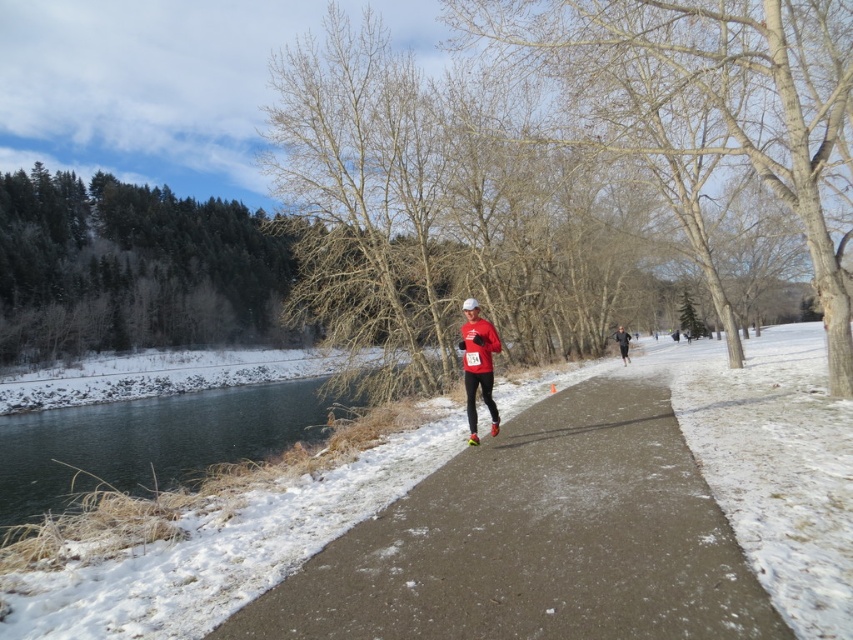
Where is `smooth asphalt path at center`? Image resolution: width=853 pixels, height=640 pixels. smooth asphalt path at center is located at coordinates click(x=537, y=540).

Which is below, smooth asphalt path at center or black running suit at center?

smooth asphalt path at center is lower down.

Describe the element at coordinates (537, 540) in the screenshot. This screenshot has height=640, width=853. I see `smooth asphalt path at center` at that location.

Locate an element on the screen. This screenshot has height=640, width=853. smooth asphalt path at center is located at coordinates pos(537,540).

Measure the distance between point [10,196] and camera.

The distance of point [10,196] from camera is 89.65 meters.

Is green matte trees at upper left shorter than black running suit at center?

Incorrect, green matte trees at upper left's height does not fall short of black running suit at center's.

Is point (109, 324) positioned after point (618, 333)?

Yes, it is.

Where is `green matte trees at upper left`? The width and height of the screenshot is (853, 640). green matte trees at upper left is located at coordinates (132, 268).

Which is in front, point (479, 35) or point (24, 416)?

Point (479, 35)

Does bare wood tree at center appear under greenish-blue water at lower left?

Actually, bare wood tree at center is above greenish-blue water at lower left.

The height and width of the screenshot is (640, 853). What are the coordinates of `bare wood tree at center` in the screenshot? It's located at (706, 99).

The height and width of the screenshot is (640, 853). I want to click on bare wood tree at center, so click(x=706, y=99).